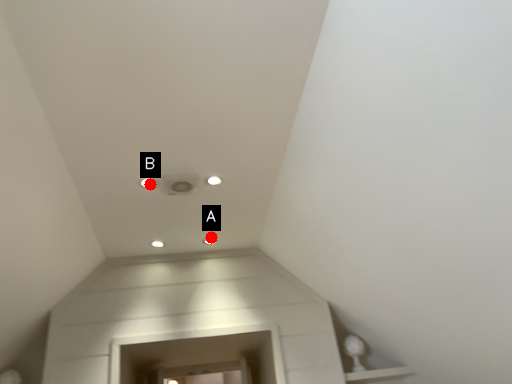
Question: Two points are circled on the image, labeled by A and B beside each circle. Which of the following is the farthest from the observer?

Choices:
 (A) A is further
 (B) B is further

Answer: (A)